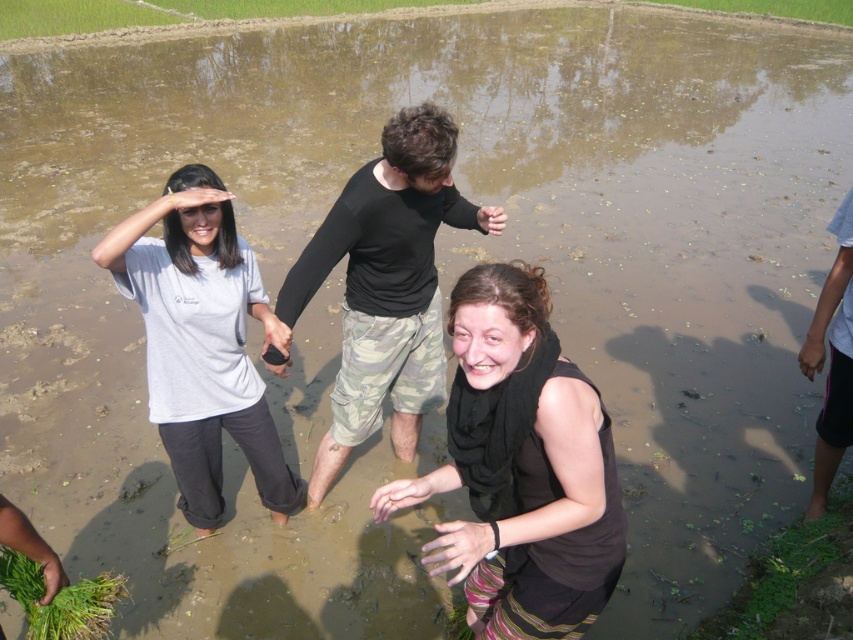
You are a photographer trying to capture a group photo of the black matte scarf at center and the white matte shirt at left. The camera you have can focus on objects within a 3 feet range. Can you take a photo of both subjects without moving the camera?

The black matte scarf at center is 3.73 feet away from the white matte shirt at left. Since the distance between them is greater than the camera focus range of 3 feet, you cannot capture both subjects in focus without moving the camera.

In the scene shown: You are standing at the point with coordinates point (209, 285) and want to walk towards the point with coordinates point (498, 500). Which direction should you move relative to your current position?

You should move forward since point (498, 500) is in front of point (209, 285).

Where is the black matte scarf at center located in the image?

The black matte scarf at center is located at point (x=521, y=467) in the image.